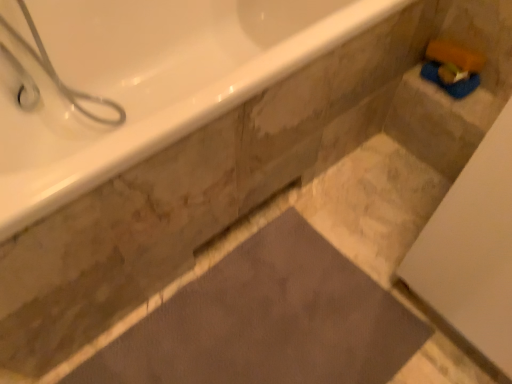
Question: From the image's perspective, is dark gray matte bath mat at center over white glossy shower at upper left?

Choices:
 (A) no
 (B) yes

Answer: (A)

Question: From the image's perspective, is dark gray matte bath mat at center beneath white glossy shower at upper left?

Choices:
 (A) yes
 (B) no

Answer: (A)

Question: Is dark gray matte bath mat at center thinner than white glossy shower at upper left?

Choices:
 (A) no
 (B) yes

Answer: (A)

Question: Is dark gray matte bath mat at center outside white glossy shower at upper left?

Choices:
 (A) yes
 (B) no

Answer: (A)

Question: Does dark gray matte bath mat at center turn towards white glossy shower at upper left?

Choices:
 (A) yes
 (B) no

Answer: (B)

Question: Is dark gray matte bath mat at center directly adjacent to white glossy shower at upper left?

Choices:
 (A) yes
 (B) no

Answer: (B)

Question: Is white glossy shower at upper left far from dark gray matte bath mat at center?

Choices:
 (A) no
 (B) yes

Answer: (A)

Question: From a real-world perspective, is white glossy shower at upper left over dark gray matte bath mat at center?

Choices:
 (A) no
 (B) yes

Answer: (B)

Question: Is white glossy shower at upper left beside dark gray matte bath mat at center?

Choices:
 (A) yes
 (B) no

Answer: (B)

Question: Is white glossy shower at upper left thinner than dark gray matte bath mat at center?

Choices:
 (A) yes
 (B) no

Answer: (A)

Question: From the image's perspective, would you say white glossy shower at upper left is positioned over dark gray matte bath mat at center?

Choices:
 (A) yes
 (B) no

Answer: (A)

Question: Considering the relative positions of white glossy shower at upper left and dark gray matte bath mat at center in the image provided, is white glossy shower at upper left to the left of dark gray matte bath mat at center from the viewer's perspective?

Choices:
 (A) no
 (B) yes

Answer: (B)

Question: Is white glossy bathtub at upper left turned away from white glossy shower at upper left?

Choices:
 (A) no
 (B) yes

Answer: (B)